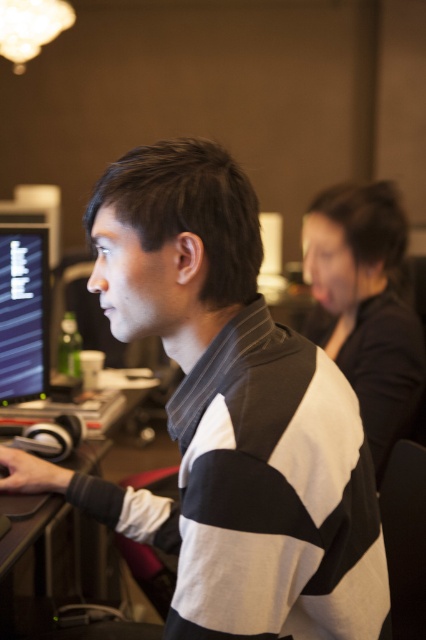
Does white striped sweater at center have a lesser height compared to black matte shirt at upper right?

A: Yes.

Based on the photo, how far apart are white striped sweater at center and black matte shirt at upper right?

white striped sweater at center is 32.93 inches from black matte shirt at upper right.

Is point (112, 515) less distant than point (385, 435)?

That is True.

What are the coordinates of `white striped sweater at center` in the screenshot? It's located at (230, 417).

Can you confirm if black matte shirt at upper right is wider than matte black monitor at left?

Correct, the width of black matte shirt at upper right exceeds that of matte black monitor at left.

Who is more forward, (382, 316) or (22, 388)?

Result: Positioned in front is point (22, 388).

The width and height of the screenshot is (426, 640). What are the coordinates of `black matte shirt at upper right` in the screenshot? It's located at (365, 305).

Does white striped sweater at center have a smaller size compared to matte black monitor at left?

Incorrect, white striped sweater at center is not smaller in size than matte black monitor at left.

Does white striped sweater at center have a larger size compared to matte black monitor at left?

Yes, white striped sweater at center is bigger than matte black monitor at left.

The image size is (426, 640). Find the location of `white striped sweater at center`. white striped sweater at center is located at coordinates (230, 417).